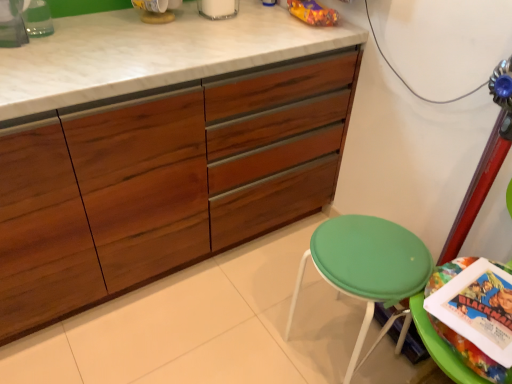
Question: From a real-world perspective, is green fabric stool at lower right above or below green plastic stool at lower right?

Choices:
 (A) above
 (B) below

Answer: (B)

Question: From the image's perspective, is green fabric stool at lower right above or below green plastic stool at lower right?

Choices:
 (A) below
 (B) above

Answer: (A)

Question: Which of these objects is positioned farthest from the green plastic stool at lower right?

Choices:
 (A) wooden cabinet at center
 (B) green fabric stool at lower right

Answer: (A)

Question: Considering the real-world distances, which object is closest to the wooden cabinet at center?

Choices:
 (A) green plastic stool at lower right
 (B) green fabric stool at lower right

Answer: (B)